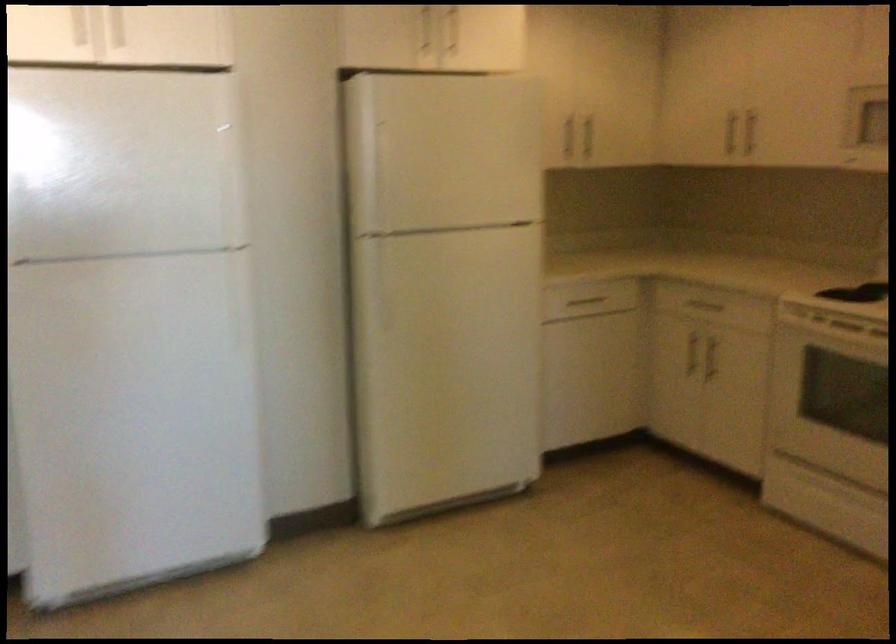
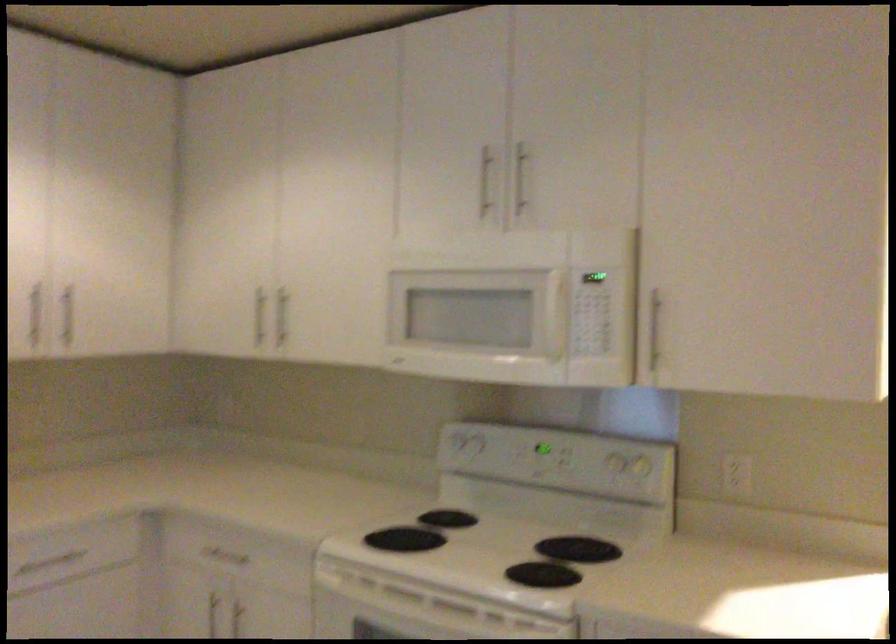
The images are taken continuously from a first-person perspective. In which direction are you moving?

The cameraman walked toward right, forward.